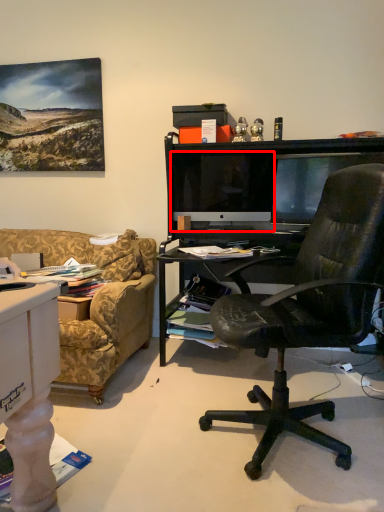
Question: Considering the relative positions of computer monitor (annotated by the red box) and television in the image provided, where is computer monitor (annotated by the red box) located with respect to the staircase?

Choices:
 (A) right
 (B) left

Answer: (B)